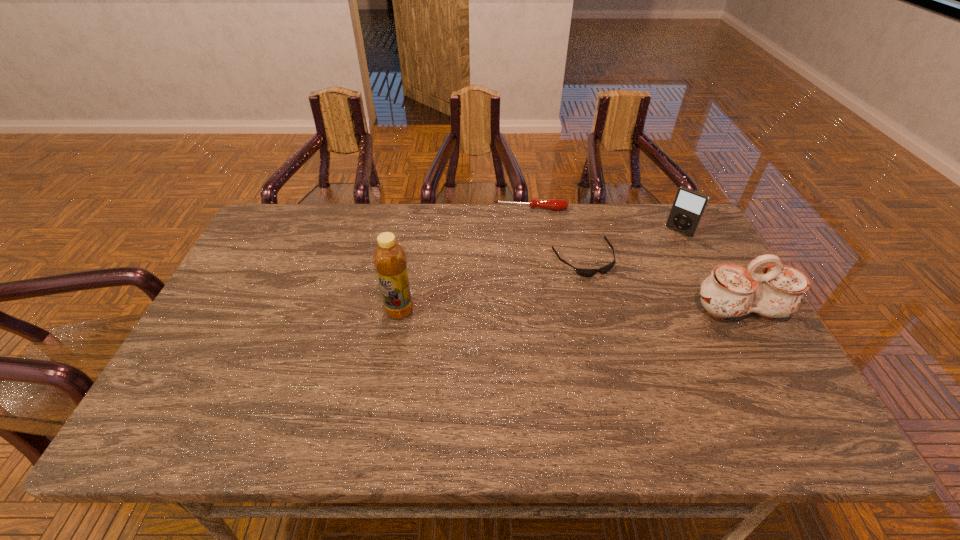
Find the location of `screwdriver that is at the far edge`. screwdriver that is at the far edge is located at coordinates (552, 204).

Find the location of a particular element. The height and width of the screenshot is (540, 960). sunglasses located in the far edge section of the desktop is located at coordinates (582, 272).

Locate an element on the screen. The height and width of the screenshot is (540, 960). iPod situated at the far edge is located at coordinates (689, 205).

Identify the location of chinaware at the right edge. (730, 291).

Where is `iPod that is at the right edge`? This screenshot has height=540, width=960. iPod that is at the right edge is located at coordinates (689, 205).

Identify the location of object positioned at the far right corner. (689, 205).

In the image, there is a desktop. Where is `blank space at the far edge`? The width and height of the screenshot is (960, 540). blank space at the far edge is located at coordinates point(589,203).

Image resolution: width=960 pixels, height=540 pixels. Find the location of `free space at the near edge`. free space at the near edge is located at coordinates (446, 373).

You are a GUI agent. You are given a task and a screenshot of the screen. Output one action in this format:
    pyautogui.click(x=<x>, y=<y>)
    Task: Click on the free space at the left edge
    The image size is (960, 540).
    Given the screenshot: What is the action you would take?
    pyautogui.click(x=216, y=353)

Find the location of a particular element. free region at the right edge of the desktop is located at coordinates click(699, 299).